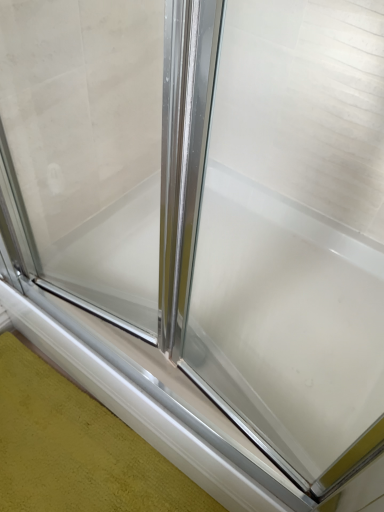
Question: Should I look upward or downward to see clear glass shower door at center?

Choices:
 (A) down
 (B) up

Answer: (B)

Question: Is white glossy window sill at lower center at the left side of clear glass shower door at center?

Choices:
 (A) yes
 (B) no

Answer: (A)

Question: From a real-world perspective, is white glossy window sill at lower center over clear glass shower door at center?

Choices:
 (A) no
 (B) yes

Answer: (A)

Question: Is the position of white glossy window sill at lower center more distant than that of clear glass shower door at center?

Choices:
 (A) no
 (B) yes

Answer: (B)

Question: Is white glossy window sill at lower center far from clear glass shower door at center?

Choices:
 (A) no
 (B) yes

Answer: (A)

Question: Considering the relative sizes of white glossy window sill at lower center and clear glass shower door at center in the image provided, is white glossy window sill at lower center thinner than clear glass shower door at center?

Choices:
 (A) yes
 (B) no

Answer: (B)

Question: Is white glossy window sill at lower center taller than clear glass shower door at center?

Choices:
 (A) yes
 (B) no

Answer: (B)

Question: Can white glossy window sill at lower center be found inside clear glass shower door at center?

Choices:
 (A) no
 (B) yes

Answer: (A)

Question: Does clear glass shower door at center have a larger size compared to white glossy window sill at lower center?

Choices:
 (A) yes
 (B) no

Answer: (A)

Question: Does clear glass shower door at center have a lesser width compared to white glossy window sill at lower center?

Choices:
 (A) yes
 (B) no

Answer: (A)

Question: Can you confirm if clear glass shower door at center is taller than white glossy window sill at lower center?

Choices:
 (A) no
 (B) yes

Answer: (B)

Question: Are clear glass shower door at center and white glossy window sill at lower center making contact?

Choices:
 (A) no
 (B) yes

Answer: (A)

Question: From a real-world perspective, is clear glass shower door at center located higher than white glossy window sill at lower center?

Choices:
 (A) yes
 (B) no

Answer: (A)

Question: Is white glossy window sill at lower center bigger or smaller than clear glass shower door at center?

Choices:
 (A) small
 (B) big

Answer: (A)